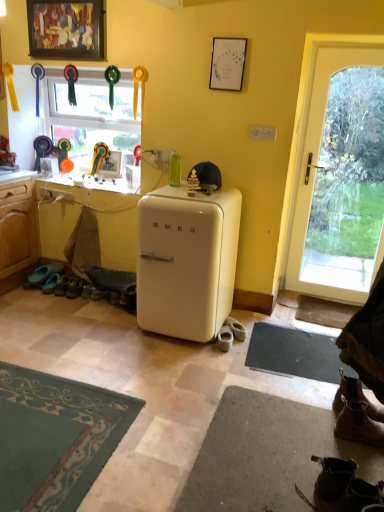
Question: Considering the relative positions of white glossy refrigerator at center and white suede shoes at lower center, which is the fourth footwear from front to back, in the image provided, is white glossy refrigerator at center behind white suede shoes at lower center, which is the fourth footwear from front to back,?

Choices:
 (A) yes
 (B) no

Answer: (B)

Question: Is white glossy refrigerator at center at the right side of white suede shoes at lower center, which is the second footwear from back to front?

Choices:
 (A) yes
 (B) no

Answer: (B)

Question: Could you tell me if white glossy refrigerator at center is facing white suede shoes at lower center, acting as the third footwear starting from the right?

Choices:
 (A) yes
 (B) no

Answer: (B)

Question: Can you confirm if white glossy refrigerator at center is shorter than white suede shoes at lower center, which is the fourth footwear from front to back?

Choices:
 (A) yes
 (B) no

Answer: (B)

Question: Is white glossy refrigerator at center smaller than white suede shoes at lower center, acting as the third footwear starting from the right?

Choices:
 (A) yes
 (B) no

Answer: (B)

Question: Is white glossy refrigerator at center positioned with its back to white suede shoes at lower center, which is the fourth footwear from front to back?

Choices:
 (A) no
 (B) yes

Answer: (A)

Question: Does clear glass window at upper left have a greater height compared to white glossy refrigerator at center?

Choices:
 (A) no
 (B) yes

Answer: (A)

Question: From a real-world perspective, is clear glass window at upper left positioned over white glossy refrigerator at center based on gravity?

Choices:
 (A) yes
 (B) no

Answer: (A)

Question: Is clear glass window at upper left at the left side of white glossy refrigerator at center?

Choices:
 (A) yes
 (B) no

Answer: (A)

Question: Is clear glass window at upper left outside white glossy refrigerator at center?

Choices:
 (A) yes
 (B) no

Answer: (A)

Question: From the image's perspective, is clear glass window at upper left on top of white glossy refrigerator at center?

Choices:
 (A) yes
 (B) no

Answer: (A)

Question: Could you tell me if clear glass window at upper left is facing white glossy refrigerator at center?

Choices:
 (A) no
 (B) yes

Answer: (A)

Question: From the image's perspective, would you say white glass door at right is positioned over white glossy refrigerator at center?

Choices:
 (A) no
 (B) yes

Answer: (B)